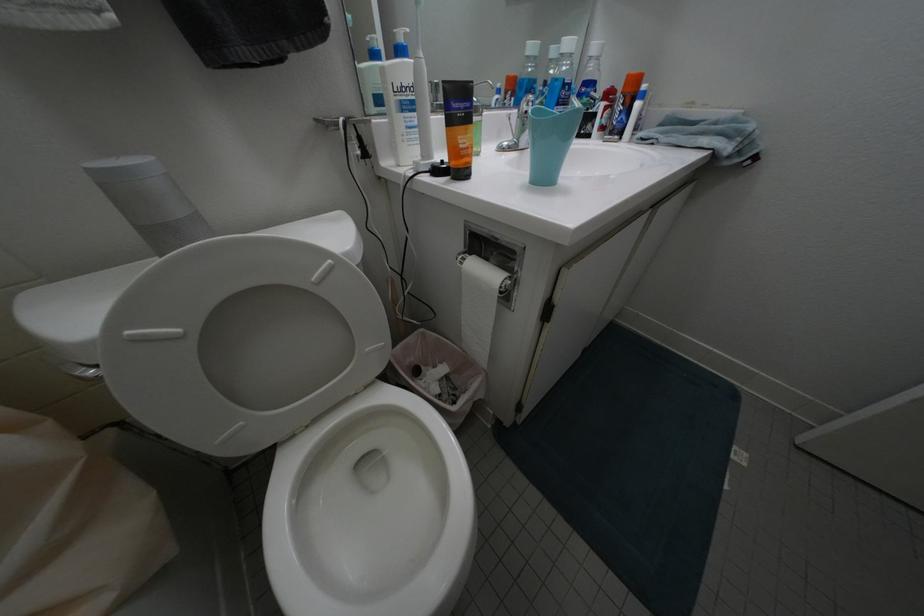
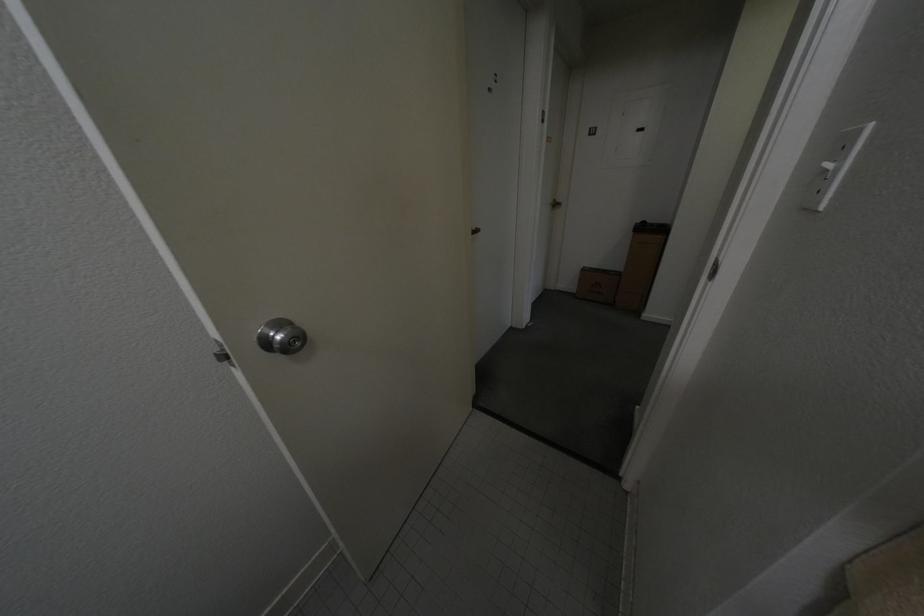
First-person continuous shooting, in which direction is the camera rotating?

The rotation direction of the camera is right-down.